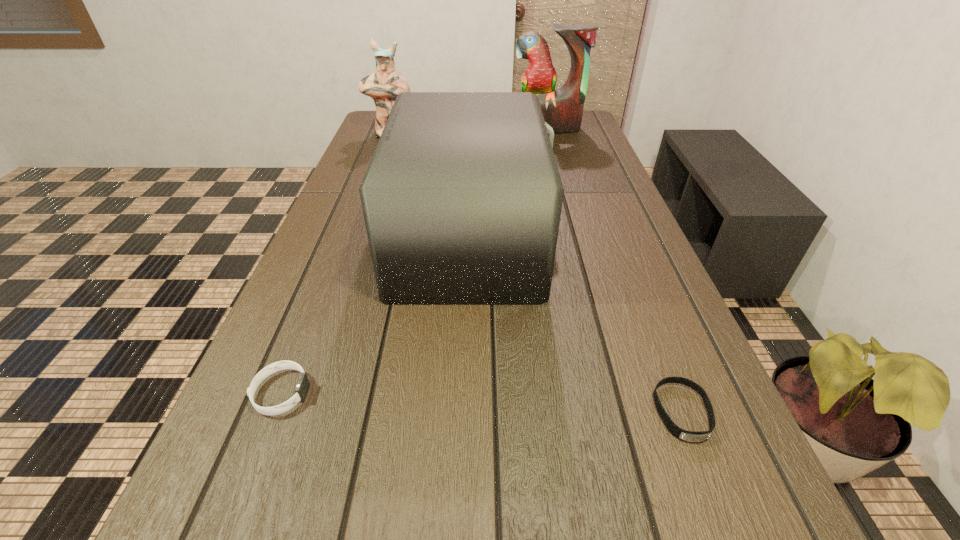
Find the location of a particular element. The image size is (960, 540). parrot is located at coordinates (562, 109).

Find the location of a particular element. This screenshot has height=540, width=960. figurine is located at coordinates (386, 83).

At what (x,y) coordinates should I click in order to perform the action: click on the third farthest object. Please return your answer as a coordinate pair (x, y). Image resolution: width=960 pixels, height=540 pixels. Looking at the image, I should click on (462, 199).

Find the location of a particular element. the left wristband is located at coordinates (303, 384).

Identify the location of the taller wristband. (303, 384).

Where is `the right wristband`? The image size is (960, 540). the right wristband is located at coordinates (691, 436).

Identify the location of the shortest object. The image size is (960, 540). (691, 436).

In order to click on free point located at the face of the parrot in this screenshot , I will do `click(560, 170)`.

Where is `free spot located 0.050m on the front-facing side of the figurine`? This screenshot has width=960, height=540. free spot located 0.050m on the front-facing side of the figurine is located at coordinates click(387, 146).

The height and width of the screenshot is (540, 960). In order to click on vacant point located 0.090m on the front-facing side of the third nearest object in this screenshot , I will do [588, 238].